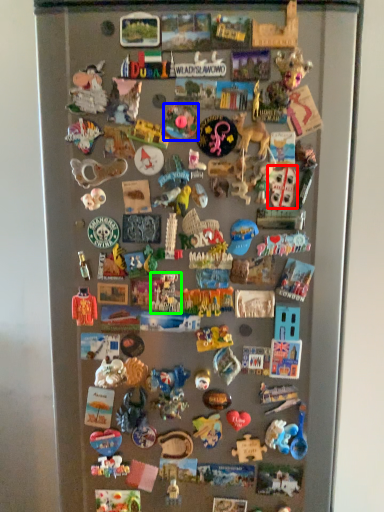
Question: Considering the real-world distances, which object is closest to toy (highlighted by a red box)? toy (highlighted by a blue box) or toy (highlighted by a green box).

Choices:
 (A) toy
 (B) toy

Answer: (A)